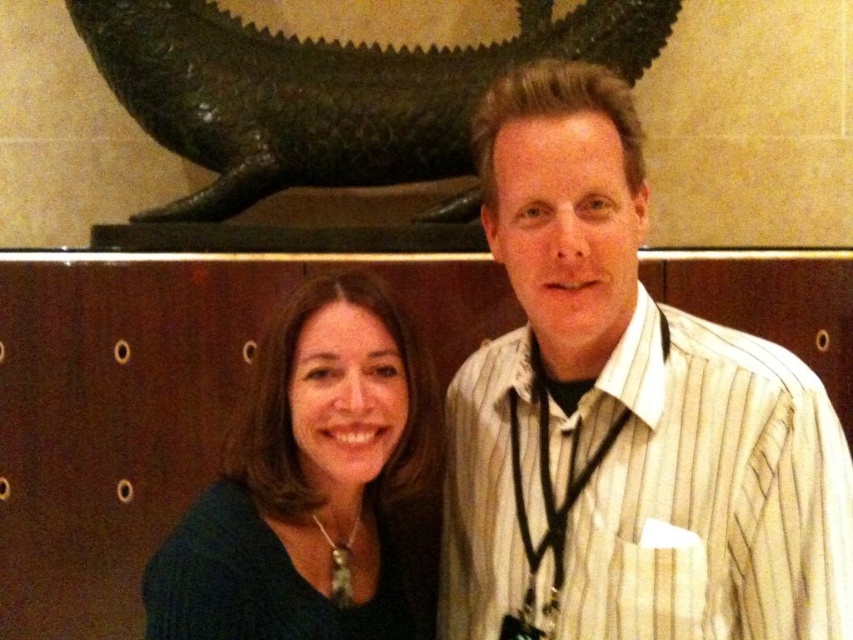
Which is behind, point (624, 156) or point (161, 208)?

Positioned behind is point (161, 208).

Is white striped shirt at center positioned at the back of green patina stone sculpture at upper center?

No.

Is point (578, 410) farther from viewer compared to point (399, 84)?

No, it is not.

Find the location of a particular element. This screenshot has height=640, width=853. white striped shirt at center is located at coordinates (624, 417).

Is dark green sweater at center taller than green patina stone sculpture at upper center?

Incorrect, dark green sweater at center's height is not larger of green patina stone sculpture at upper center's.

Is point (363, 554) in front of point (300, 83)?

Yes, it is.

Image resolution: width=853 pixels, height=640 pixels. What are the coordinates of `dark green sweater at center` in the screenshot? It's located at (314, 486).

Which is in front, point (461, 384) or point (375, 333)?

Point (375, 333)

Does point (753, 544) come behind point (432, 605)?

No, it is in front of (432, 605).

This screenshot has width=853, height=640. Find the location of `white striped shirt at center`. white striped shirt at center is located at coordinates (624, 417).

The width and height of the screenshot is (853, 640). Find the location of `white striped shirt at center`. white striped shirt at center is located at coordinates (624, 417).